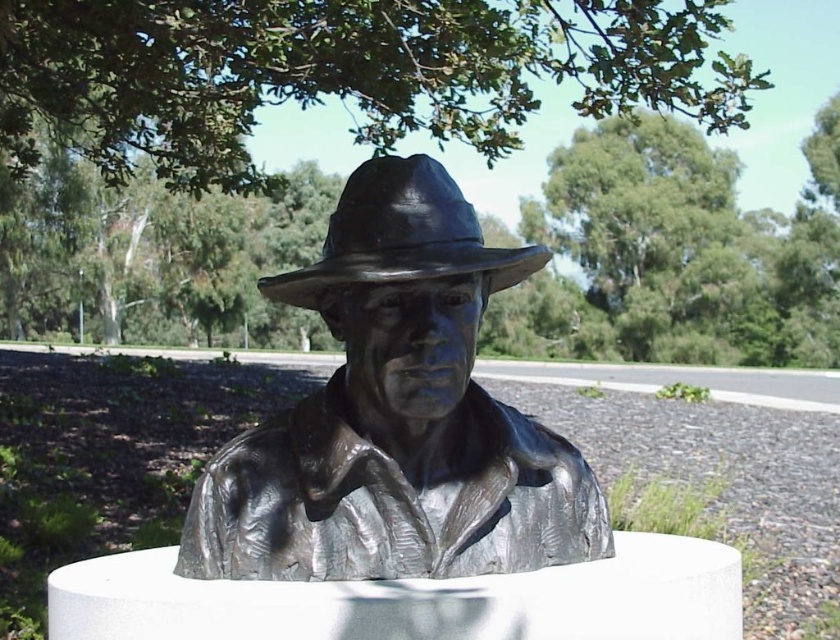
Can you confirm if bronze statue at center is positioned to the right of green leafy tree at upper center?

Correct, you'll find bronze statue at center to the right of green leafy tree at upper center.

Who is more distant from viewer, (518,518) or (243,84)?

The point (243,84) is behind.

Identify the location of bronze statue at center. (396, 417).

Locate an element on the screen. green leafy tree at upper center is located at coordinates (340, 74).

Can you confirm if green leafy tree at upper center is positioned to the left of shiny black fedora at center?

Indeed, green leafy tree at upper center is positioned on the left side of shiny black fedora at center.

This screenshot has width=840, height=640. Describe the element at coordinates (340, 74) in the screenshot. I see `green leafy tree at upper center` at that location.

Where is `green leafy tree at upper center`? green leafy tree at upper center is located at coordinates (340, 74).

Which is below, bronze statue at center or shiny black fedora at center?

Positioned lower is bronze statue at center.

Is bronze statue at center below shiny black fedora at center?

Yes.

The image size is (840, 640). Describe the element at coordinates (396, 417) in the screenshot. I see `bronze statue at center` at that location.

Identify the location of bronze statue at center. Image resolution: width=840 pixels, height=640 pixels. (396, 417).